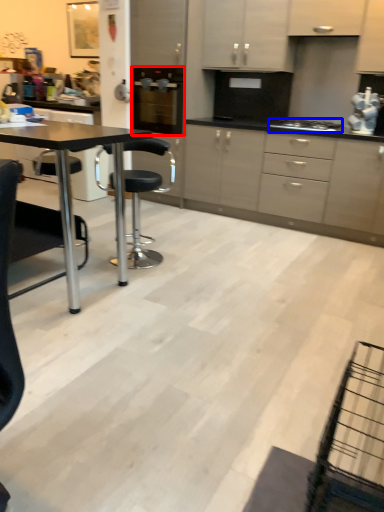
Question: Which of the following is the farthest to the observer, kitchen appliance (highlighted by a red box) or gas stove (highlighted by a blue box)?

Choices:
 (A) kitchen appliance
 (B) gas stove

Answer: (A)